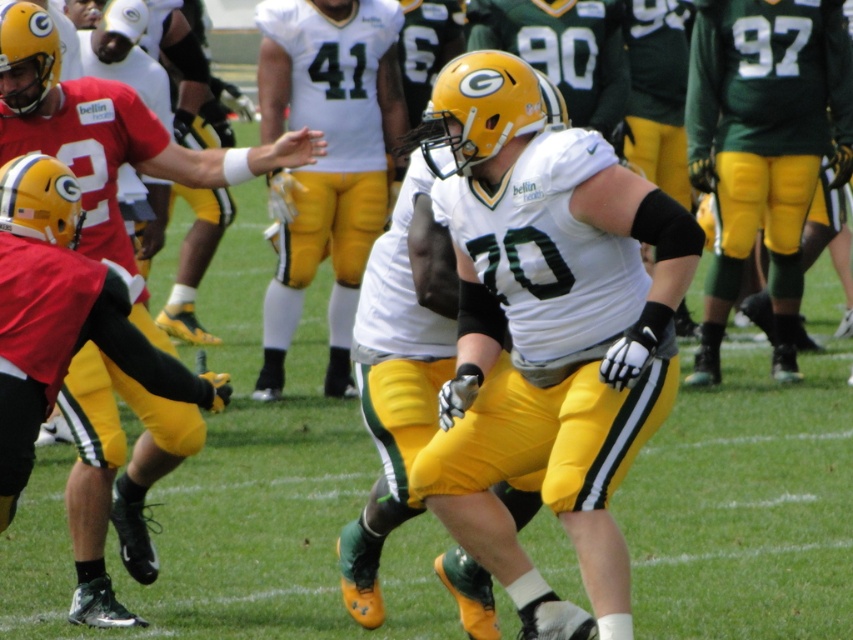
Between matte green jersey at center and white jersey at center, which one is positioned higher?

Positioned higher is matte green jersey at center.

Based on the photo, does matte green jersey at center have a larger size compared to white jersey at center?

Actually, matte green jersey at center might be smaller than white jersey at center.

Between point (734, 248) and point (383, 193), which one is positioned behind?

The point (383, 193) is more distant.

Locate an element on the screen. The height and width of the screenshot is (640, 853). matte green jersey at center is located at coordinates (763, 147).

Between white matte jersey at center and matte black jersey at center, which one has less height?

Standing shorter between the two is white matte jersey at center.

Is white matte jersey at center taller than matte black jersey at center?

In fact, white matte jersey at center may be shorter than matte black jersey at center.

Describe the element at coordinates (547, 333) in the screenshot. I see `white matte jersey at center` at that location.

Where is `white matte jersey at center`? white matte jersey at center is located at coordinates (547, 333).

Is point (614, 429) less distant than point (845, 138)?

Yes, it is in front of point (845, 138).

Measure the distance between white matte jersey at center and matte green jersey at center.

white matte jersey at center and matte green jersey at center are 4.04 meters apart.

Is point (618, 317) positioned before point (724, 298)?

Yes, it is.

You are a GUI agent. You are given a task and a screenshot of the screen. Output one action in this format:
    pyautogui.click(x=<x>, y=<y>)
    Task: Click on the white matte jersey at center
    
    Given the screenshot: What is the action you would take?
    pyautogui.click(x=547, y=333)